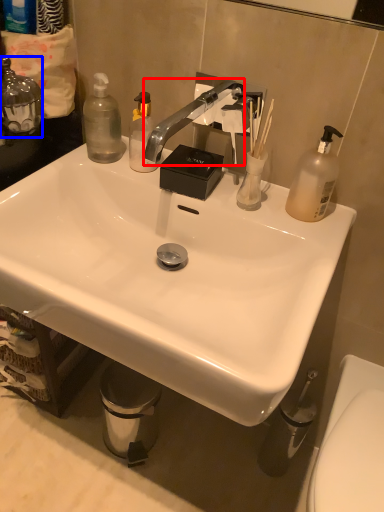
Question: Which of the following is the farthest to the observer, faucet (highlighted by a red box) or bottle (highlighted by a blue box)?

Choices:
 (A) faucet
 (B) bottle

Answer: (B)